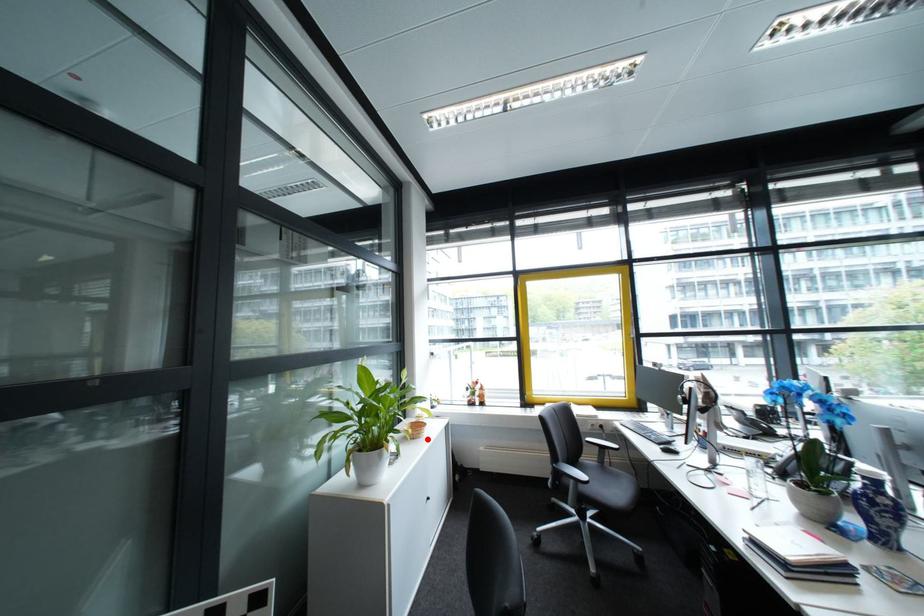
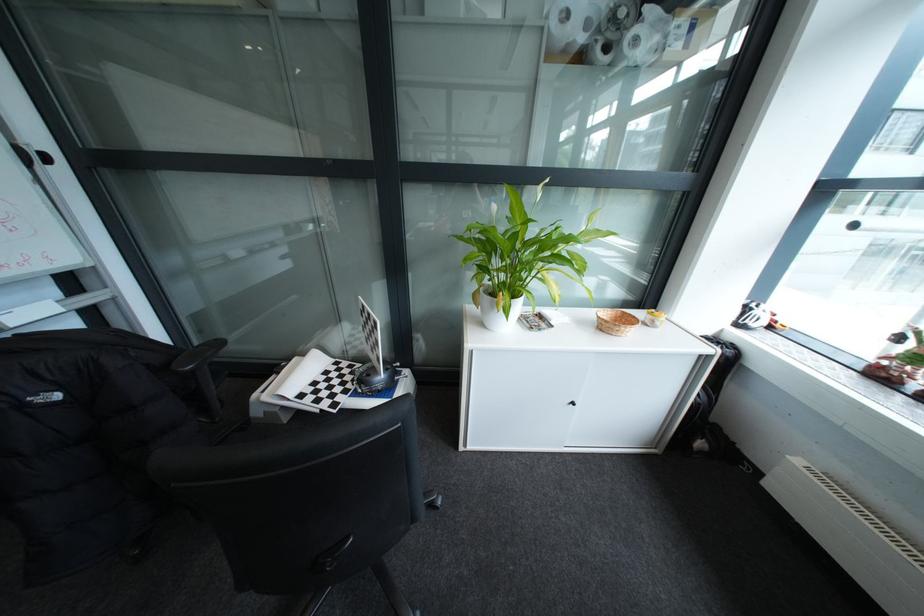
In the second image, find the point that corresponds to the highlighted location in the first image.

(614, 331)